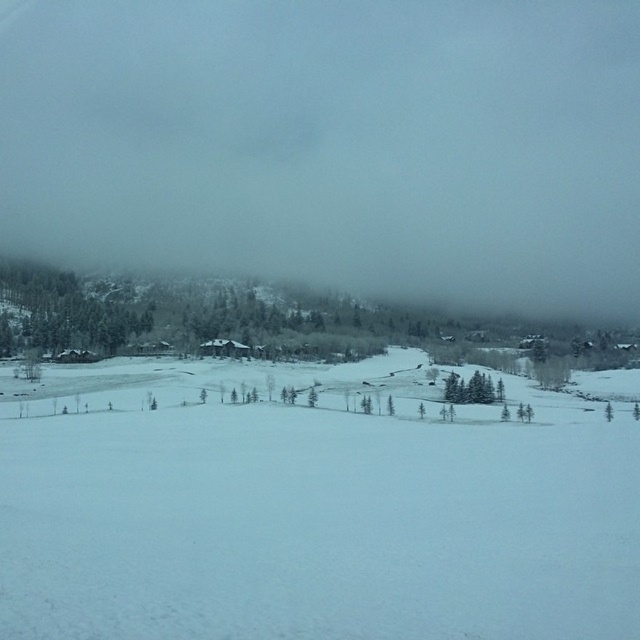
You are standing at the edge of the white snow ski slope at center and want to walk towards the white fog at upper center. Is the fog closer to you or further away than the ski slope?

The white fog at upper center is further to the viewer than the white snow ski slope at center, so the fog is closer to you than the ski slope.